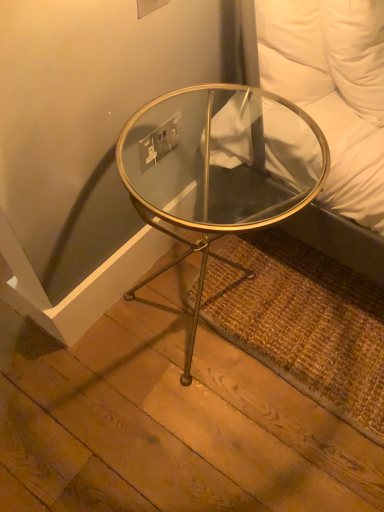
Question: Does point (180, 100) appear closer or farther from the camera than point (152, 136)?

Choices:
 (A) farther
 (B) closer

Answer: (A)

Question: From the image's perspective, is clear glass table at center above or below white plastic electric outlet at upper center?

Choices:
 (A) below
 (B) above

Answer: (A)

Question: Considering the relative positions of clear glass table at center and white plastic electric outlet at upper center in the image provided, is clear glass table at center to the left or to the right of white plastic electric outlet at upper center?

Choices:
 (A) left
 (B) right

Answer: (B)

Question: Is white plastic electric outlet at upper center situated inside clear glass table at center or outside?

Choices:
 (A) outside
 (B) inside

Answer: (A)

Question: From the image's perspective, is white plastic electric outlet at upper center above or below clear glass table at center?

Choices:
 (A) above
 (B) below

Answer: (A)

Question: Visually, is white plastic electric outlet at upper center positioned to the left or to the right of clear glass table at center?

Choices:
 (A) right
 (B) left

Answer: (B)

Question: Considering the positions of white plastic electric outlet at upper center and clear glass table at center in the image, is white plastic electric outlet at upper center wider or thinner than clear glass table at center?

Choices:
 (A) thin
 (B) wide

Answer: (A)